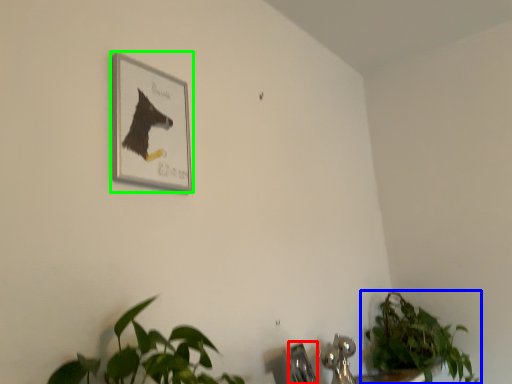
Question: Considering the real-world distances, which object is farthest from faucet (highlighted by a red box)? houseplant (highlighted by a blue box) or picture frame (highlighted by a green box)?

Choices:
 (A) houseplant
 (B) picture frame

Answer: (B)